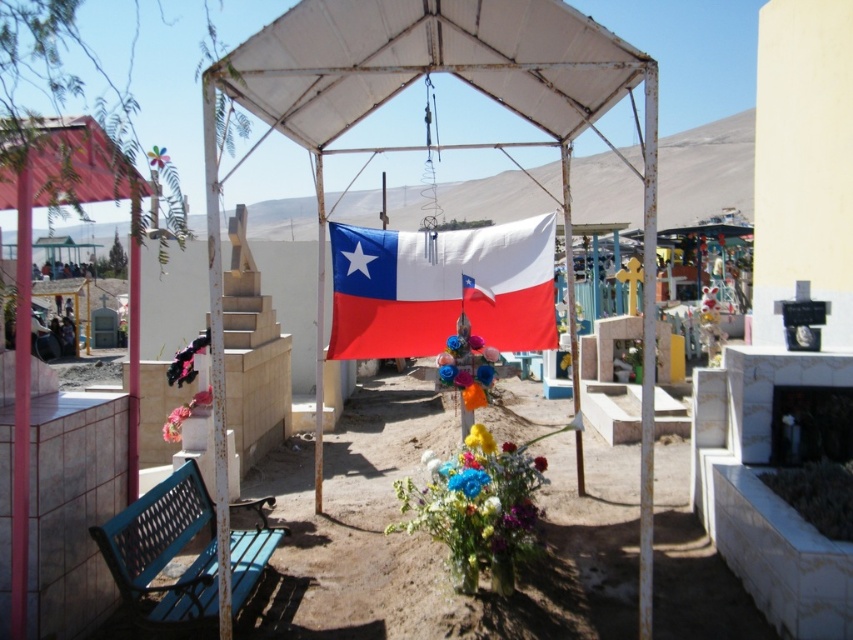
Does point (421, 296) lie behind point (146, 548)?

Yes, it is.

Is point (343, 308) less distant than point (252, 538)?

No, it is not.

Is point (548, 298) closer to camera compared to point (184, 620)?

No, (548, 298) is behind (184, 620).

This screenshot has width=853, height=640. In order to click on red-white fabric flag at center in this screenshot , I will do `click(440, 289)`.

Who is positioned more to the left, matte black vase at lower left or pink fabric flower at lower left?

Positioned to the left is pink fabric flower at lower left.

How distant is matte black vase at lower left from pink fabric flower at lower left?

They are 10.90 inches apart.

I want to click on matte black vase at lower left, so click(x=186, y=360).

This screenshot has width=853, height=640. Find the location of `matte black vase at lower left`. matte black vase at lower left is located at coordinates (186, 360).

Does fluffy bouquet at center have a lesser height compared to matte black vase at lower left?

Incorrect, fluffy bouquet at center's height does not fall short of matte black vase at lower left's.

Can you confirm if fluffy bouquet at center is wider than matte black vase at lower left?

Indeed, fluffy bouquet at center has a greater width compared to matte black vase at lower left.

Find the location of `fluffy bouquet at center`. fluffy bouquet at center is located at coordinates (476, 506).